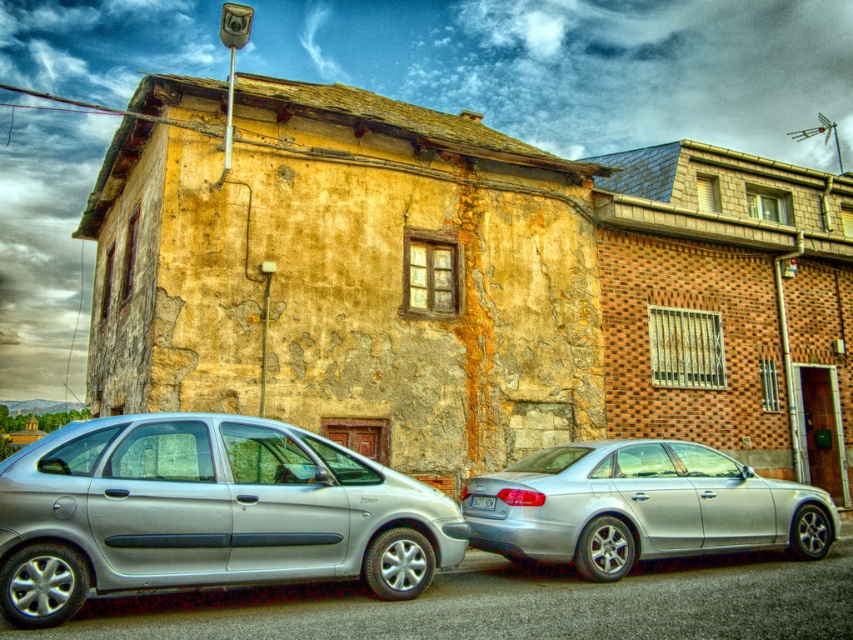
Does silver metallic sedan at center appear under white plastic license plate at center?

Yes, silver metallic sedan at center is below white plastic license plate at center.

Who is more distant from viewer, (590, 506) or (476, 506)?

The point (476, 506) is more distant.

Is point (730, 502) farther from viewer compared to point (474, 500)?

No, (730, 502) is closer to viewer.

The image size is (853, 640). I want to click on silver metallic sedan at center, so click(641, 506).

Looking at this image, does silver metallic hatchback at lower left appear on the left side of white plastic license plate at center?

Indeed, silver metallic hatchback at lower left is positioned on the left side of white plastic license plate at center.

Is silver metallic hatchback at lower left further to camera compared to white plastic license plate at center?

No, it is in front of white plastic license plate at center.

Does point (183, 452) come farther from viewer compared to point (492, 499)?

No, (183, 452) is closer to viewer.

Find the location of a particular element. The image size is (853, 640). silver metallic hatchback at lower left is located at coordinates (207, 513).

Who is lower down, silver metallic hatchback at lower left or silver metallic sedan at center?

silver metallic sedan at center

Can you confirm if silver metallic hatchback at lower left is smaller than silver metallic sedan at center?

Actually, silver metallic hatchback at lower left might be larger than silver metallic sedan at center.

Describe the element at coordinates (207, 513) in the screenshot. I see `silver metallic hatchback at lower left` at that location.

At what (x,y) coordinates should I click in order to perform the action: click on silver metallic hatchback at lower left. Please return your answer as a coordinate pair (x, y). Looking at the image, I should click on (207, 513).